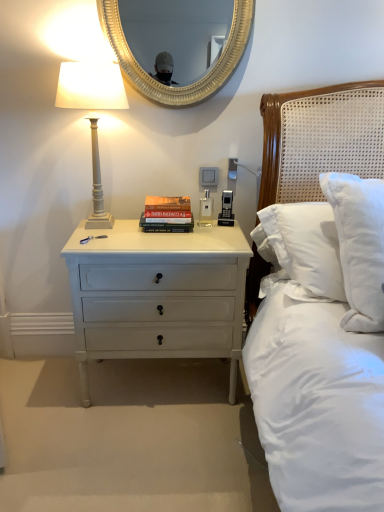
The width and height of the screenshot is (384, 512). Describe the element at coordinates (91, 87) in the screenshot. I see `white painted wood bedside lamp at left` at that location.

Where is `gold textured mirror at upper center`? The image size is (384, 512). gold textured mirror at upper center is located at coordinates (175, 32).

Which object is further away from the camera, white painted wood nightstand at lower left or white painted wood bedside lamp at left?

white painted wood nightstand at lower left is further from the camera.

Which object is wider, white painted wood nightstand at lower left or white painted wood bedside lamp at left?

white painted wood nightstand at lower left is wider.

Consider the image. Which of these two, white painted wood nightstand at lower left or white painted wood bedside lamp at left, is bigger?

Bigger between the two is white painted wood nightstand at lower left.

I want to click on bedside lamp above the white painted wood nightstand at lower left (from a real-world perspective), so click(x=91, y=87).

Which object is closer to the camera, hardcover book at center or white painted wood nightstand at lower left?

white painted wood nightstand at lower left is closer to the camera.

Does hardcover book at center have a smaller size compared to white painted wood nightstand at lower left?

Yes, hardcover book at center is smaller than white painted wood nightstand at lower left.

In the image, is hardcover book at center on the left side or the right side of white painted wood nightstand at lower left?

hardcover book at center is to the right of white painted wood nightstand at lower left.

Locate an element on the screen. The width and height of the screenshot is (384, 512). nightstand located below the hardcover book at center (from the image's perspective) is located at coordinates (157, 295).

From the picture: Considering the sizes of objects white painted wood nightstand at lower left and gold textured mirror at upper center in the image provided, who is shorter, white painted wood nightstand at lower left or gold textured mirror at upper center?

gold textured mirror at upper center is shorter.

Considering the relative sizes of white painted wood nightstand at lower left and gold textured mirror at upper center in the image provided, is white painted wood nightstand at lower left thinner than gold textured mirror at upper center?

No, white painted wood nightstand at lower left is not thinner than gold textured mirror at upper center.

Considering the relative sizes of white painted wood nightstand at lower left and gold textured mirror at upper center in the image provided, is white painted wood nightstand at lower left smaller than gold textured mirror at upper center?

No.

Is white painted wood nightstand at lower left in front of or behind gold textured mirror at upper center in the image?

white painted wood nightstand at lower left is in front of gold textured mirror at upper center.

From a real-world perspective, which is physically above, hardcover book at center or white painted wood bedside lamp at left?

white painted wood bedside lamp at left, from a real-world perspective.

Considering the relative sizes of hardcover book at center and white painted wood bedside lamp at left in the image provided, is hardcover book at center thinner than white painted wood bedside lamp at left?

Yes.

Is hardcover book at center situated inside white painted wood bedside lamp at left or outside?

hardcover book at center is located beyond the bounds of white painted wood bedside lamp at left.

Considering their positions, is hardcover book at center located in front of or behind white painted wood bedside lamp at left?

hardcover book at center is behind white painted wood bedside lamp at left.

From the image's perspective, is white painted wood bedside lamp at left on white painted wood nightstand at lower left?

Indeed, from the image's perspective, white painted wood bedside lamp at left is shown above white painted wood nightstand at lower left.

Which point is more distant from viewer, (x=67, y=74) or (x=237, y=340)?

Point (x=237, y=340)

Considering the sizes of objects white painted wood bedside lamp at left and white painted wood nightstand at lower left in the image provided, who is bigger, white painted wood bedside lamp at left or white painted wood nightstand at lower left?

white painted wood nightstand at lower left is bigger.

Can you tell me how much white painted wood bedside lamp at left and white painted wood nightstand at lower left differ in facing direction?

The angle between the facing direction of white painted wood bedside lamp at left and the facing direction of white painted wood nightstand at lower left is 0.566 degrees.

Which is closer to the camera, (112, 79) or (189, 200)?

Point (112, 79) appears to be closer to the viewer than point (189, 200).

What are the coordinates of `bedside lamp lying on the left of hardcover book at center` in the screenshot? It's located at (91, 87).

How many degrees apart are the facing directions of white painted wood bedside lamp at left and hardcover book at center?

There is a 0.000125-degree angle between the facing directions of white painted wood bedside lamp at left and hardcover book at center.

In terms of size, does white painted wood bedside lamp at left appear bigger or smaller than hardcover book at center?

white painted wood bedside lamp at left is bigger than hardcover book at center.

You are a GUI agent. You are given a task and a screenshot of the screen. Output one action in this format:
    pyautogui.click(x=<x>, y=<y>)
    Task: Click on the nightstand that appears in front of the hardcover book at center
    The height and width of the screenshot is (512, 384).
    Given the screenshot: What is the action you would take?
    pyautogui.click(x=157, y=295)

Who is taller, white painted wood nightstand at lower left or hardcover book at center?

white painted wood nightstand at lower left is taller.

Does white painted wood nightstand at lower left touch hardcover book at center?

white painted wood nightstand at lower left and hardcover book at center are not in contact.

From the image's perspective, is white painted wood nightstand at lower left over hardcover book at center?

No, from the image's perspective, white painted wood nightstand at lower left is not over hardcover book at center.

You are a GUI agent. You are given a task and a screenshot of the screen. Output one action in this format:
    pyautogui.click(x=<x>, y=<y>)
    Task: Click on the nightstand below the white painted wood bedside lamp at left (from a real-world perspective)
    Image resolution: width=384 pixels, height=512 pixels.
    Given the screenshot: What is the action you would take?
    pyautogui.click(x=157, y=295)

The height and width of the screenshot is (512, 384). I want to click on nightstand that is on the left side of hardcover book at center, so click(157, 295).

Looking at the image, which one is located closer to white painted wood nightstand at lower left, hardcover book at center or gold textured mirror at upper center?

Based on the image, hardcover book at center appears to be nearer to white painted wood nightstand at lower left.

Looking at this image, based on their spatial positions, is white painted wood nightstand at lower left or white painted wood bedside lamp at left further from hardcover book at center?

white painted wood bedside lamp at left is further to hardcover book at center.

Considering their positions, is gold textured mirror at upper center positioned further to white painted wood nightstand at lower left than white painted wood bedside lamp at left?

gold textured mirror at upper center.

Which object lies further to the anchor point hardcover book at center, white painted wood nightstand at lower left or gold textured mirror at upper center?

The object further to hardcover book at center is gold textured mirror at upper center.

Which object lies nearer to the anchor point hardcover book at center, white painted wood bedside lamp at left or gold textured mirror at upper center?

The object closer to hardcover book at center is white painted wood bedside lamp at left.

From the image, which object appears to be farther from hardcover book at center, gold textured mirror at upper center or white painted wood bedside lamp at left?

Among the two, gold textured mirror at upper center is located further to hardcover book at center.

Estimate the real-world distances between objects in this image. Which object is further from white painted wood nightstand at lower left, white painted wood bedside lamp at left or hardcover book at center?

white painted wood bedside lamp at left is further to white painted wood nightstand at lower left.

Based on their spatial positions, is white painted wood bedside lamp at left or hardcover book at center further from gold textured mirror at upper center?

hardcover book at center is further to gold textured mirror at upper center.

At what (x,y) coordinates should I click in order to perform the action: click on paperback book between white painted wood bedside lamp at left and white painted wood nightstand at lower left vertically. Please return your answer as a coordinate pair (x, y). This screenshot has width=384, height=512. Looking at the image, I should click on (167, 215).

Identify the location of paperback book that lies between gold textured mirror at upper center and white painted wood nightstand at lower left from top to bottom. (167, 215).

Identify the location of bedside lamp between gold textured mirror at upper center and white painted wood nightstand at lower left from top to bottom. (91, 87).

The image size is (384, 512). Find the location of `bedside lamp between gold textured mirror at upper center and hardcover book at center vertically`. bedside lamp between gold textured mirror at upper center and hardcover book at center vertically is located at coordinates (91, 87).